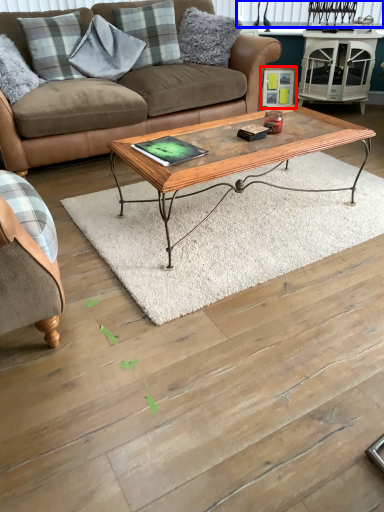
Question: Which object appears farthest to the camera in this image, picture frame (highlighted by a red box) or window screen (highlighted by a blue box)?

Choices:
 (A) picture frame
 (B) window screen

Answer: (A)